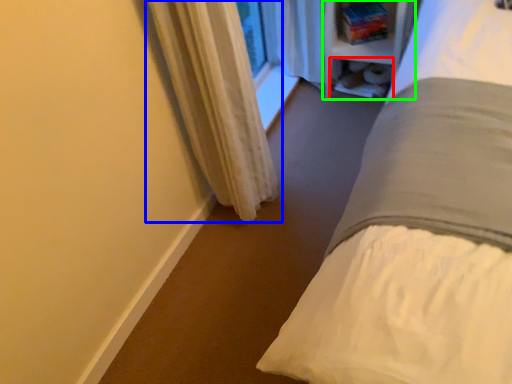
Question: Which is nearer to the shelf (highlighted by a red box)? curtain (highlighted by a blue box) or bookshelf (highlighted by a green box).

Choices:
 (A) curtain
 (B) bookshelf

Answer: (B)